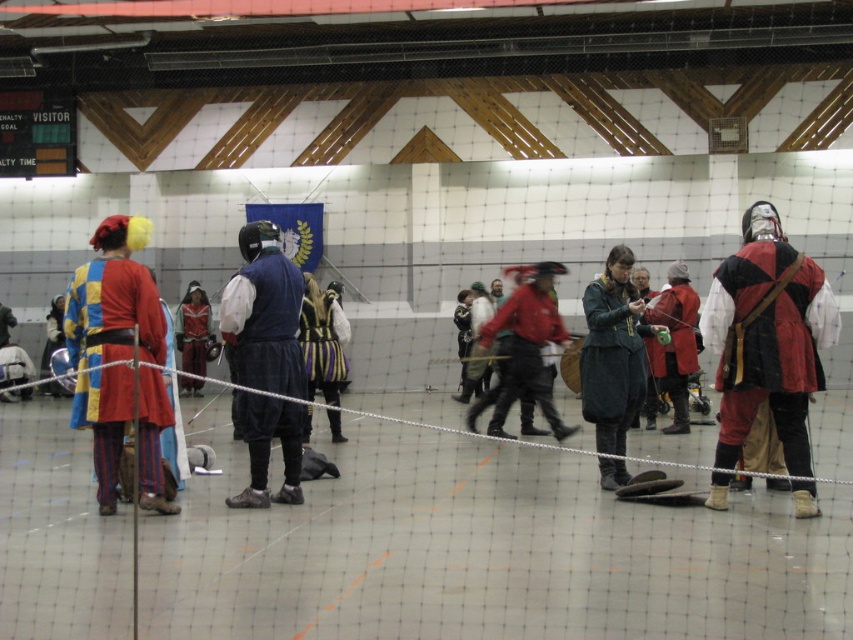
Is matte blue vest at center bigger than green matte coat at center?

Actually, matte blue vest at center might be smaller than green matte coat at center.

Does matte blue vest at center lie behind green matte coat at center?

No, it is not.

Describe the element at coordinates (265, 314) in the screenshot. The height and width of the screenshot is (640, 853). I see `matte blue vest at center` at that location.

The height and width of the screenshot is (640, 853). Identify the location of matte blue vest at center. (265, 314).

Between striped velvet cape at center and shiny silver armor at center, which one appears on the left side from the viewer's perspective?

Positioned to the left is shiny silver armor at center.

What do you see at coordinates (322, 340) in the screenshot? I see `striped velvet cape at center` at bounding box center [322, 340].

Which is behind, point (316, 285) or point (183, 296)?

Point (183, 296)

I want to click on striped velvet cape at center, so click(322, 340).

Who is lower down, matte multicolored tunic at left or red velvet cape at center?

matte multicolored tunic at left is lower down.

Between matte multicolored tunic at left and red velvet cape at center, which one appears on the right side from the viewer's perspective?

red velvet cape at center is more to the right.

Between point (94, 240) and point (518, 324), which one is positioned behind?

Point (518, 324)

Identify the location of matte multicolored tunic at left. The image size is (853, 640). [119, 358].